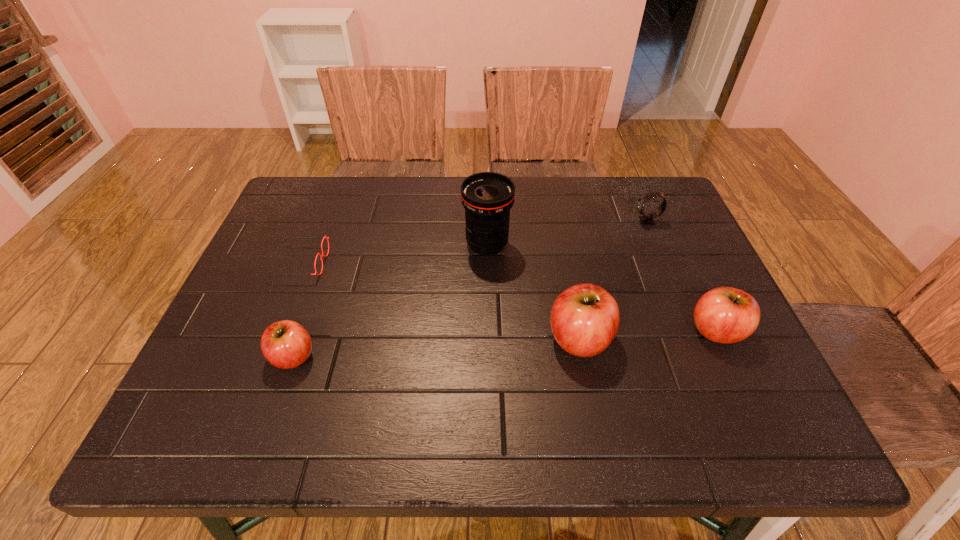
The height and width of the screenshot is (540, 960). I want to click on apple that is at the right edge, so click(726, 315).

You are a GUI agent. You are given a task and a screenshot of the screen. Output one action in this format:
    pyautogui.click(x=<x>, y=<y>)
    Task: Click on the watch that is positioned at the right edge
    
    Given the screenshot: What is the action you would take?
    pyautogui.click(x=647, y=219)

Where is `object that is at the near left corner`? Image resolution: width=960 pixels, height=540 pixels. object that is at the near left corner is located at coordinates (286, 344).

You are a GUI agent. You are given a task and a screenshot of the screen. Output one action in this format:
    pyautogui.click(x=<x>, y=<y>)
    Task: Click on the object present at the far right corner
    
    Given the screenshot: What is the action you would take?
    click(647, 219)

Where is `free location at the far edge`? Image resolution: width=960 pixels, height=540 pixels. free location at the far edge is located at coordinates (391, 184).

You are a GUI agent. You are given a task and a screenshot of the screen. Output one action in this format:
    pyautogui.click(x=<x>, y=<y>)
    Task: Click on the free spot at the near edge of the desktop
    This screenshot has height=540, width=960.
    Given the screenshot: What is the action you would take?
    pyautogui.click(x=585, y=367)

What are the coordinates of `vacant space at the right edge` in the screenshot? It's located at (741, 351).

You are a GUI agent. You are given a task and a screenshot of the screen. Output one action in this format:
    pyautogui.click(x=<x>, y=<y>)
    Task: Click on the free space at the far left corner of the desktop
    Image resolution: width=960 pixels, height=540 pixels.
    Given the screenshot: What is the action you would take?
    pyautogui.click(x=306, y=200)

Identify the location of vacant space at the near left corner of the desktop. The height and width of the screenshot is (540, 960). (255, 364).

This screenshot has width=960, height=540. What are the coordinates of `vacant space at the far right corner of the desktop` in the screenshot? It's located at (660, 187).